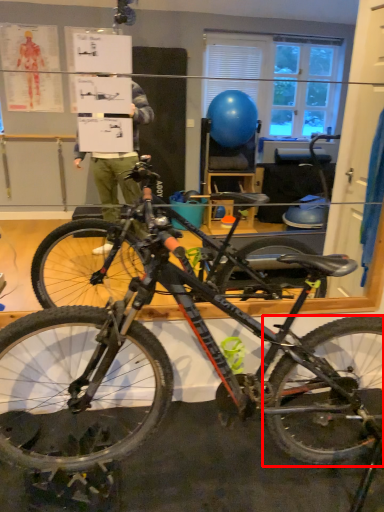
Question: In this image, where is bicycle wheel (annotated by the red box) located relative to bicycle?

Choices:
 (A) left
 (B) right

Answer: (B)